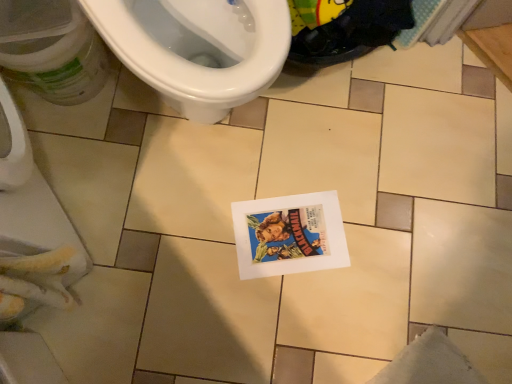
Question: From a real-world perspective, is white glossy toilet at upper left above or below white glossy toilet at upper left?

Choices:
 (A) above
 (B) below

Answer: (B)

Question: Is point (x=31, y=43) closer or farther from the camera than point (x=281, y=24)?

Choices:
 (A) closer
 (B) farther

Answer: (B)

Question: Estimate the real-world distances between objects in this image. Which object is closer to the white paper comic book at center?

Choices:
 (A) white glossy toilet at upper left
 (B) white glossy toilet at upper left

Answer: (A)

Question: Estimate the real-world distances between objects in this image. Which object is farther from the white paper comic book at center?

Choices:
 (A) white glossy toilet at upper left
 (B) white glossy toilet at upper left

Answer: (A)